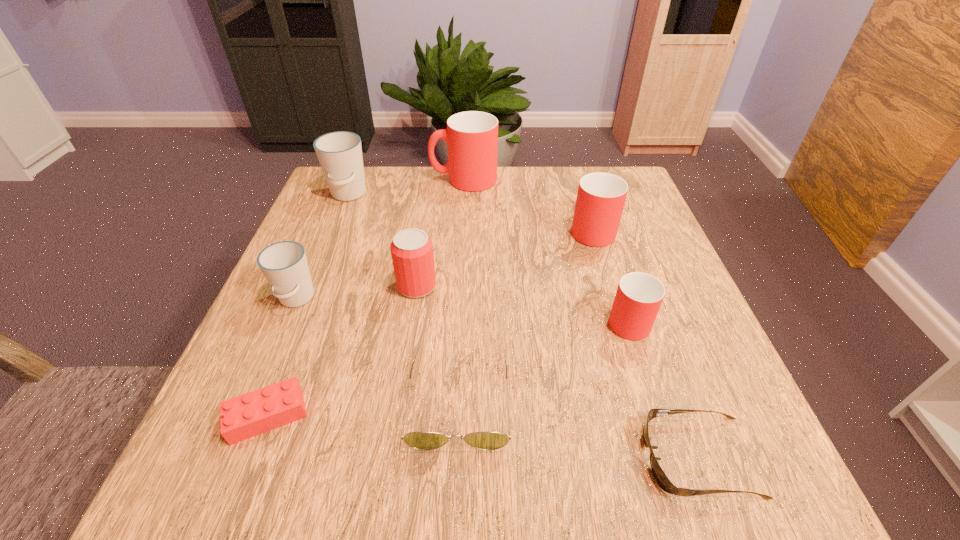
Image resolution: width=960 pixels, height=540 pixels. What are the coordinates of `Lego situated at the left edge` in the screenshot? It's located at (254, 413).

This screenshot has width=960, height=540. Find the location of `sunglasses present at the right edge`. sunglasses present at the right edge is located at coordinates (663, 481).

Image resolution: width=960 pixels, height=540 pixels. Find the location of `object that is at the far left corner`. object that is at the far left corner is located at coordinates (339, 153).

The image size is (960, 540). I want to click on object at the near left corner, so click(x=254, y=413).

Where is `object at the far right corner`? This screenshot has height=540, width=960. object at the far right corner is located at coordinates (600, 200).

Where is `object present at the near right corner`? The width and height of the screenshot is (960, 540). object present at the near right corner is located at coordinates (663, 481).

At what (x,y) coordinates should I click in order to perform the action: click on vacant space at the far edge. Please return your answer as a coordinate pair (x, y). The width and height of the screenshot is (960, 540). Looking at the image, I should click on (556, 169).

The width and height of the screenshot is (960, 540). Identify the location of vacant position at the near edge of the desktop. (642, 458).

I want to click on blank space at the left edge, so click(x=317, y=346).

What are the coordinates of `vacant space at the right edge` in the screenshot? It's located at (666, 401).